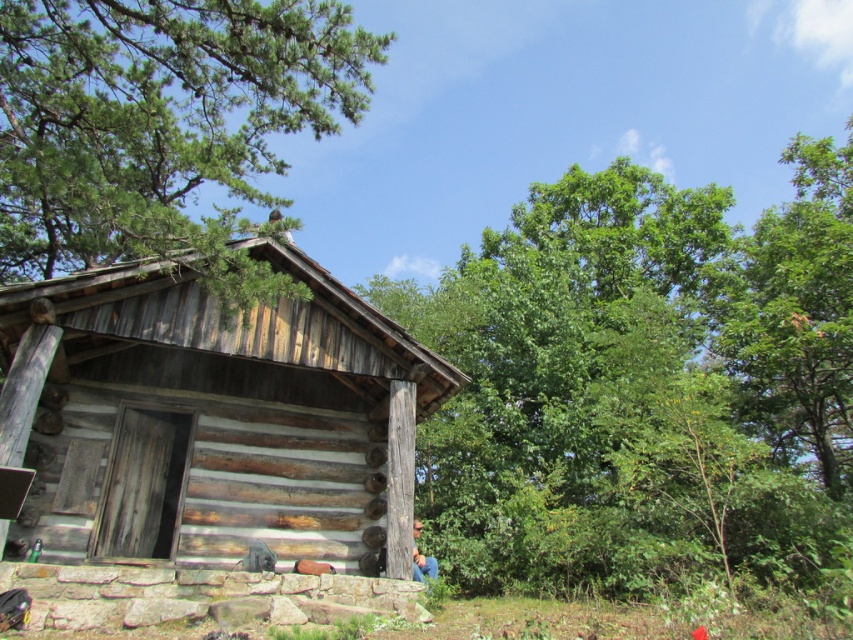
Question: Which point is farther to the camera?

Choices:
 (A) (741, 504)
 (B) (20, 348)
 (C) (154, 225)

Answer: (A)

Question: Does green leafy tree at right come in front of green pine tree at upper left?

Choices:
 (A) yes
 (B) no

Answer: (A)

Question: Which object is the farthest from the weathered wood cabin at center?

Choices:
 (A) green pine tree at upper left
 (B) green leafy tree at right

Answer: (B)

Question: Can you confirm if green leafy tree at right is wider than weathered wood cabin at center?

Choices:
 (A) yes
 (B) no

Answer: (A)

Question: Where is weathered wood cabin at center located in relation to green pine tree at upper left in the image?

Choices:
 (A) below
 (B) above

Answer: (A)

Question: Among these points, which one is nearest to the camera?

Choices:
 (A) (537, 476)
 (B) (210, 468)
 (C) (358, 97)

Answer: (B)